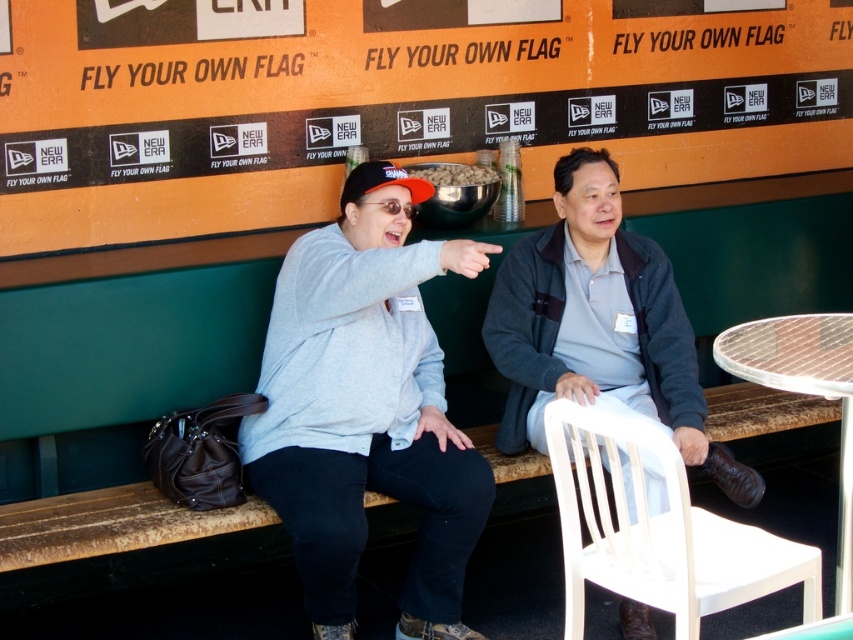
You are an athlete standing in the dugout and need to place a 1.2 meter tall flagpole on either the orange matte bulletin board at upper center or the clear plastic table at lower right. Which surface can accommodate the flagpole based on their heights?

The orange matte bulletin board at upper center has a greater height compared to the clear plastic table at lower right, so the flagpole can be placed on the orange matte bulletin board at upper center as it is taller than the clear plastic table at lower right.

You are standing in the dugout area of the stadium and need to place a small item on the nearest surface. Which object, the matte gray sweatshirt at center or the clear plastic table at lower right, is closer to you and thus a better option for placing the item?

The matte gray sweatshirt at center is closer to you than the clear plastic table at lower right, so it is the better option for placing the item.

You are standing in the dugout area of the stadium and want to move from the first point to the second point. Which direction should you move to get from point (357, 88) to point (389, 364)?

To move from point (357, 88) to point (389, 364), you should move forward since point (357, 88) is behind point (389, 364).